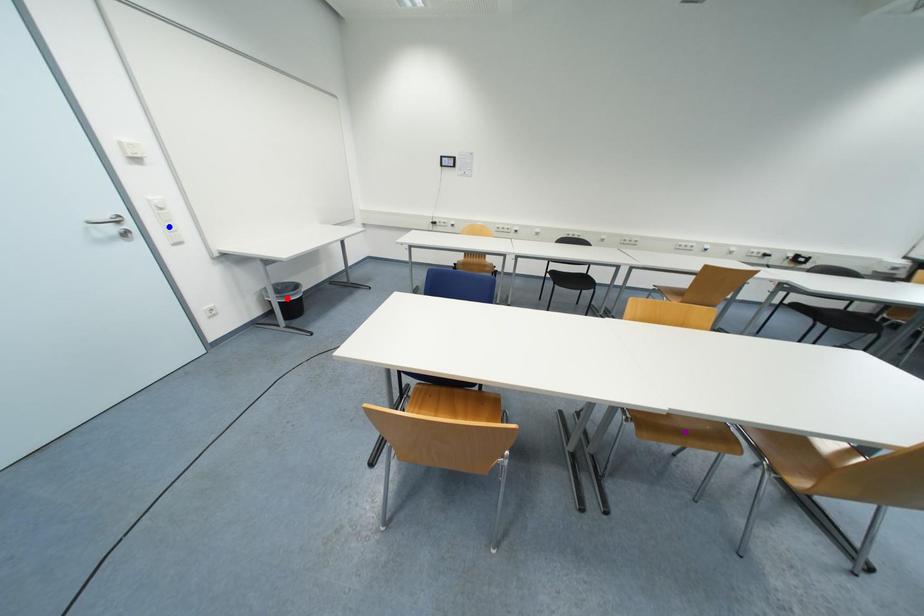
Order these from nearest to farthest:
blue point, purple point, red point

purple point
blue point
red point